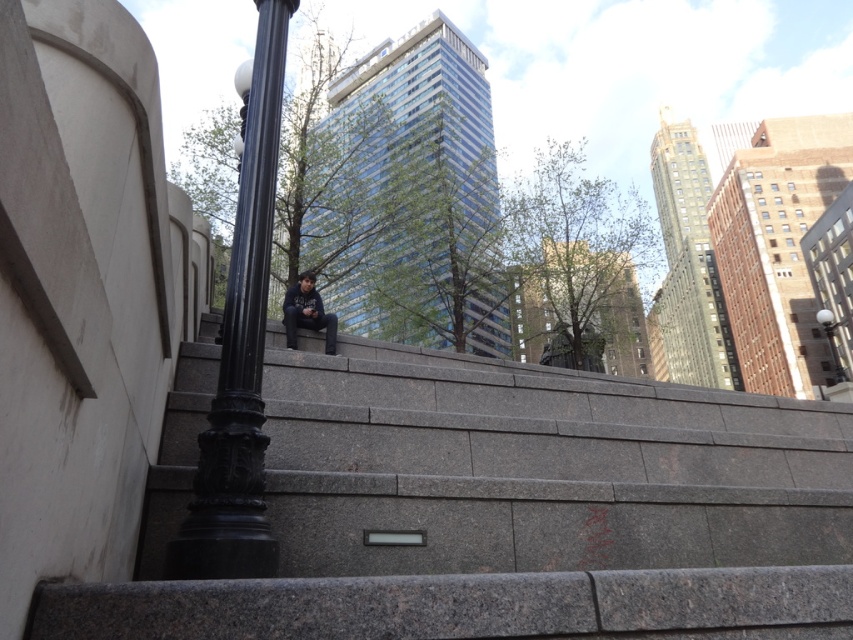
Question: From the image, what is the correct spatial relationship of dark blue hoodie at center in relation to black metal lamp post at upper right?

Choices:
 (A) below
 (B) above

Answer: (B)

Question: Estimate the real-world distances between objects in this image. Which object is closer to the gray concrete stairs at center?

Choices:
 (A) black polished metal pole at left
 (B) black metal lamp post at upper right
 (C) dark blue hoodie at center

Answer: (A)

Question: Which of the following is the closest to the observer?

Choices:
 (A) dark blue hoodie at center
 (B) black metal lamp post at upper right
 (C) black polished metal pole at left
 (D) gray concrete stairs at center

Answer: (C)

Question: Does black polished metal pole at left appear on the right side of black metal lamp post at upper right?

Choices:
 (A) yes
 (B) no

Answer: (B)

Question: Considering the relative positions of black polished metal pole at left and dark blue hoodie at center in the image provided, where is black polished metal pole at left located with respect to dark blue hoodie at center?

Choices:
 (A) above
 (B) below

Answer: (A)

Question: Considering the real-world distances, which object is farthest from the dark blue hoodie at center?

Choices:
 (A) black polished metal pole at left
 (B) black metal lamp post at upper right

Answer: (B)